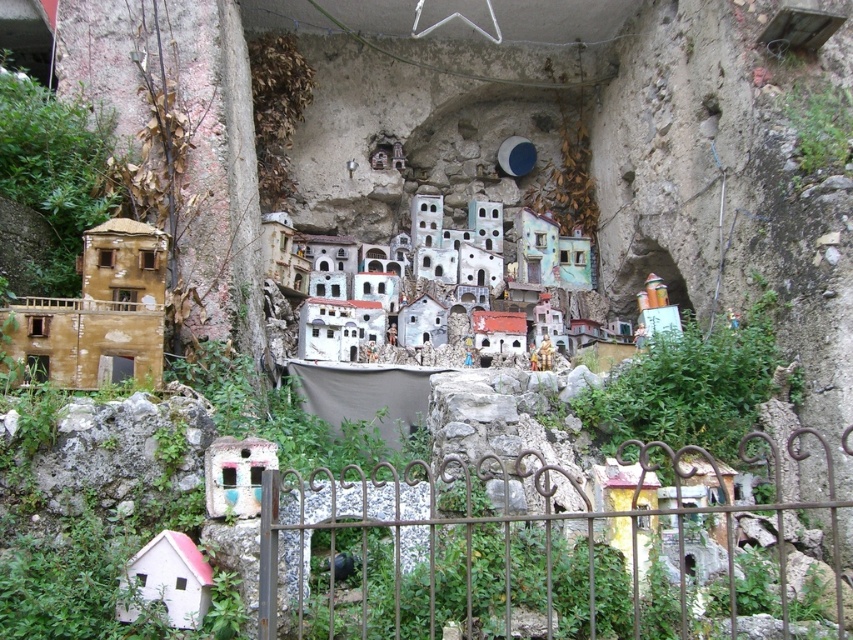
Does white painted clay houses at center come behind matte brown building at left?

That is True.

Can you confirm if white painted clay houses at center is smaller than matte brown building at left?

No, white painted clay houses at center is not smaller than matte brown building at left.

Does point (453, 280) come behind point (67, 310)?

That is True.

Where is `white painted clay houses at center`? The height and width of the screenshot is (640, 853). white painted clay houses at center is located at coordinates (437, 284).

Does brown wrought iron fence at lower center have a greater height compared to white painted clay houses at center?

Incorrect, brown wrought iron fence at lower center's height is not larger of white painted clay houses at center's.

Is point (358, 465) closer to viewer compared to point (479, 316)?

Yes.

The image size is (853, 640). What do you see at coordinates (463, 534) in the screenshot? I see `brown wrought iron fence at lower center` at bounding box center [463, 534].

Where is `brown wrought iron fence at lower center`? This screenshot has height=640, width=853. brown wrought iron fence at lower center is located at coordinates (463, 534).

Can you confirm if brown wrought iron fence at lower center is positioned below matte brown building at left?

Yes, brown wrought iron fence at lower center is below matte brown building at left.

Can you confirm if brown wrought iron fence at lower center is wider than matte brown building at left?

Yes.

What do you see at coordinates (463, 534) in the screenshot? This screenshot has width=853, height=640. I see `brown wrought iron fence at lower center` at bounding box center [463, 534].

You are a GUI agent. You are given a task and a screenshot of the screen. Output one action in this format:
    pyautogui.click(x=<x>, y=<y>)
    Task: Click on the brown wrought iron fence at lower center
    
    Given the screenshot: What is the action you would take?
    pyautogui.click(x=463, y=534)